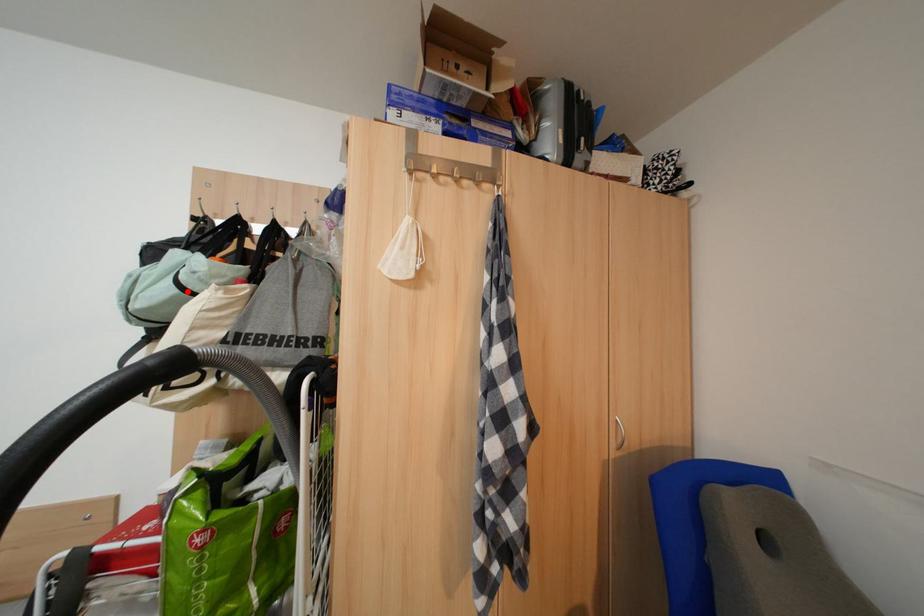
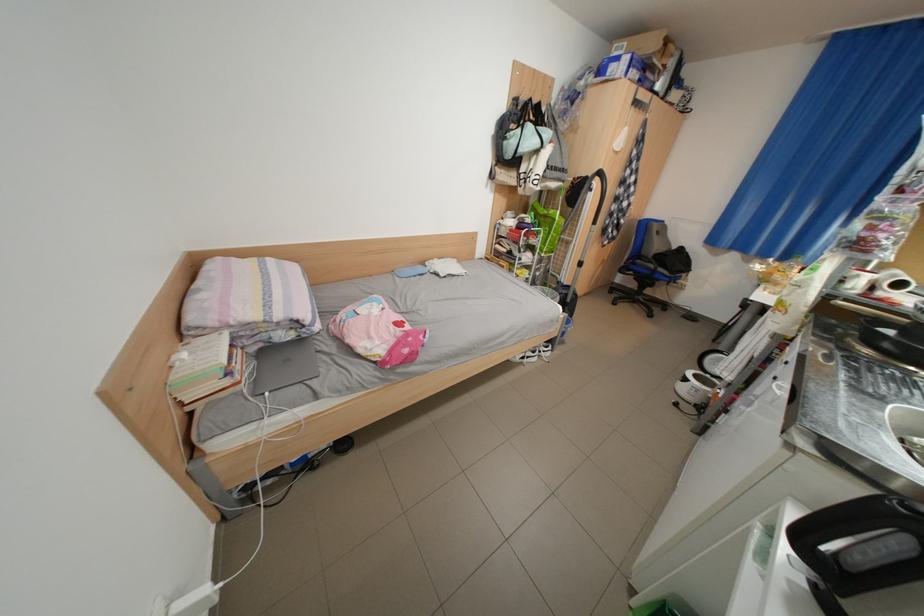
Question: I am providing you with two images of the same scene from different viewpoints. Given a red point in image1, look at the same physical point in image2. Is it:

Choices:
 (A) Closer to the viewpoint
 (B) Farther from the viewpoint

Answer: (A)